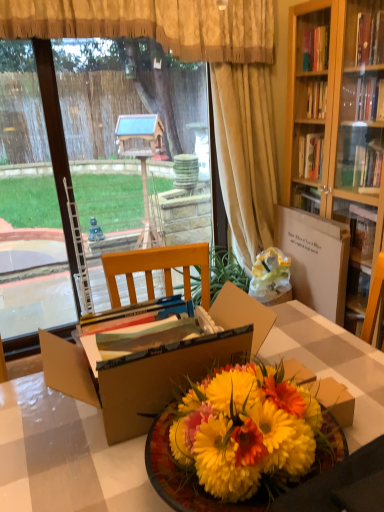
Question: Does point (236, 317) appear closer or farther from the camera than point (99, 251)?

Choices:
 (A) closer
 (B) farther

Answer: (A)

Question: From the image's perspective, is cardboard box at center above or below transparent glass window screen at left?

Choices:
 (A) above
 (B) below

Answer: (B)

Question: Which object is the closest to the gold textured curtain at upper center, the 2th curtain in the right-to-left sequence?

Choices:
 (A) beige fabric curtain at center, which is counted as the 1th curtain, starting from the right
 (B) transparent glass window screen at left
 (C) vibrant yellow petals at center
 (D) cardboard box at center
 (E) white cardboard box at center-right

Answer: (A)

Question: Estimate the real-world distances between objects in this image. Which object is closer to the beige fabric curtain at center, the second curtain from the left?

Choices:
 (A) gold textured curtain at upper center, the 2th curtain in the right-to-left sequence
 (B) cardboard box at center
 (C) wooden table at center
 (D) vibrant yellow petals at center
 (E) transparent glass window screen at left

Answer: (A)